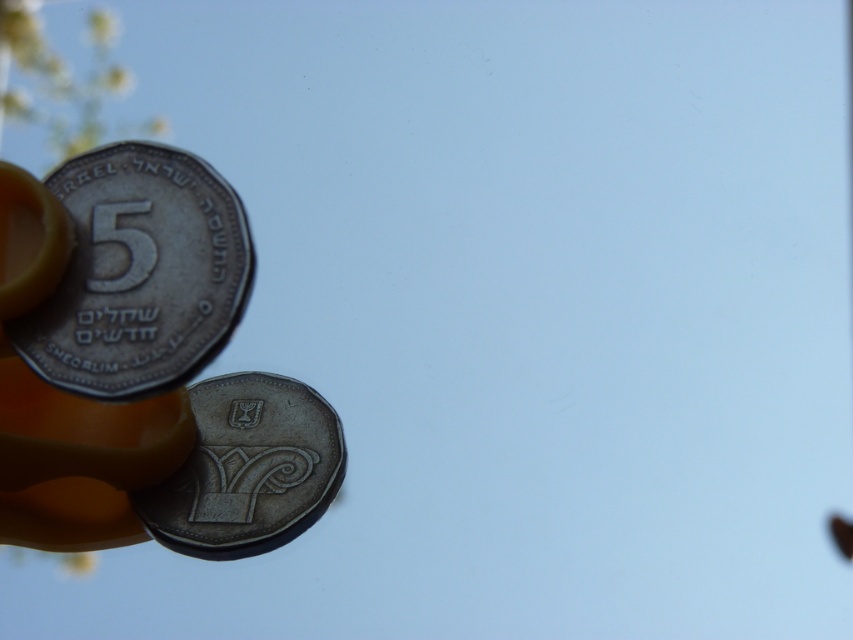
Question: Among these objects, which one is nearest to the camera?

Choices:
 (A) shiny silver coin at center
 (B) silver metallic coin at upper left

Answer: (B)

Question: Does silver metallic coin at upper left come behind shiny silver coin at center?

Choices:
 (A) no
 (B) yes

Answer: (A)

Question: Does silver metallic coin at upper left lie in front of shiny silver coin at center?

Choices:
 (A) no
 (B) yes

Answer: (B)

Question: Which point appears closest to the camera in this image?

Choices:
 (A) (141, 250)
 (B) (340, 445)

Answer: (A)

Question: Is silver metallic coin at upper left wider than shiny silver coin at center?

Choices:
 (A) no
 (B) yes

Answer: (A)